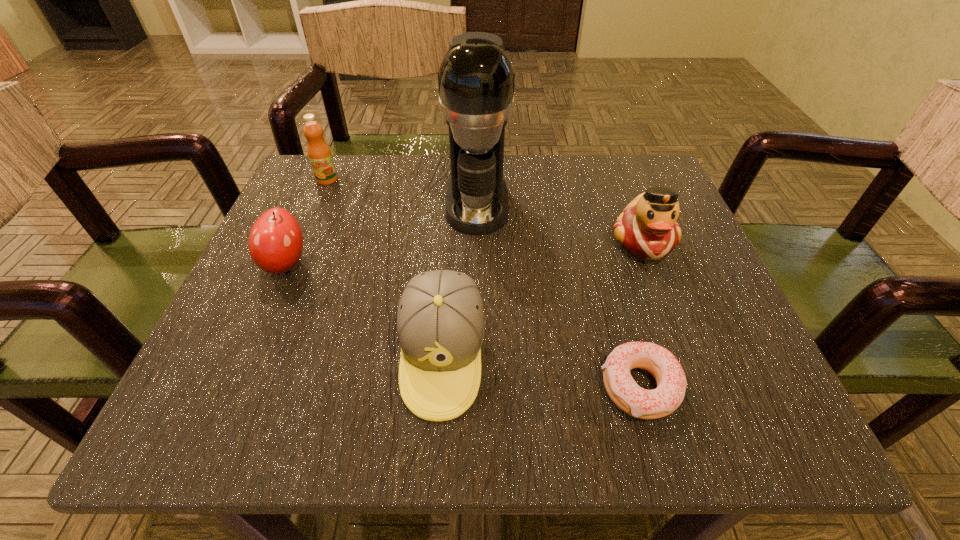
Find the location of `coffee maker`. coffee maker is located at coordinates (476, 78).

The width and height of the screenshot is (960, 540). I want to click on orange juice, so click(319, 153).

At what (x,y) coordinates should I click in order to perform the action: click on duck. Please return your answer as a coordinate pair (x, y). The image size is (960, 540). Looking at the image, I should click on (647, 229).

At what (x,y) coordinates should I click in order to perform the action: click on apple. Please return your answer as a coordinate pair (x, y). Looking at the image, I should click on (275, 243).

I want to click on baseball cap, so pyautogui.click(x=440, y=321).

You are a GUI agent. You are given a task and a screenshot of the screen. Output one action in this format:
    pyautogui.click(x=<x>, y=<y>)
    Task: Click on the shortest object
    
    Given the screenshot: What is the action you would take?
    pos(671,381)

The width and height of the screenshot is (960, 540). I want to click on vacant region located place cup under the spout of the tallest object, so click(476, 356).

I want to click on vacant space located on the front label of the orange juice, so click(x=291, y=264).

You are a GUI agent. You are given a task and a screenshot of the screen. Output one action in this format:
    pyautogui.click(x=<x>, y=<y>)
    Task: Click on the vacant space located 0.270m on the face of the duck
    This screenshot has height=540, width=960.
    Given the screenshot: What is the action you would take?
    pyautogui.click(x=712, y=420)

Where is `vacant space located 0.150m on the right of the apple`? vacant space located 0.150m on the right of the apple is located at coordinates (399, 264).